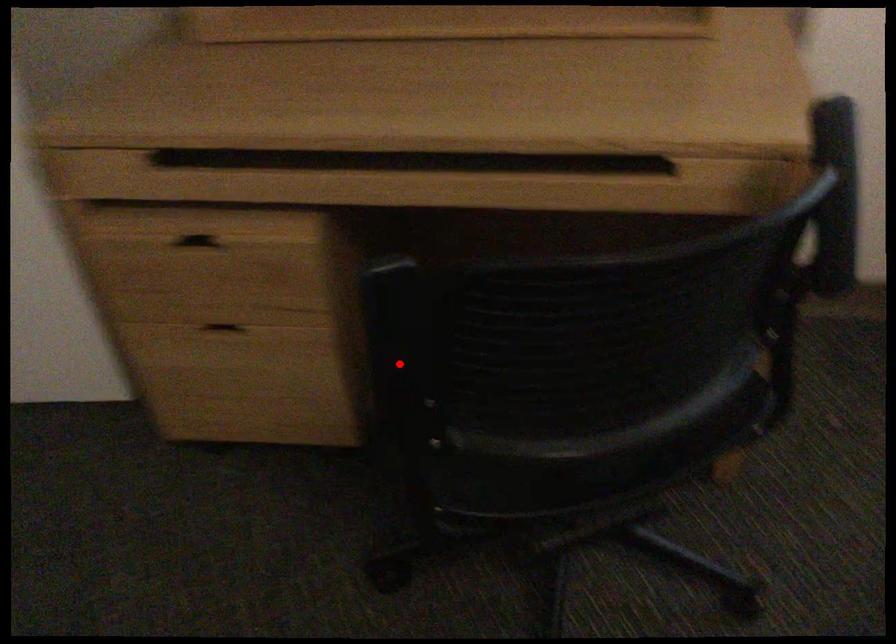
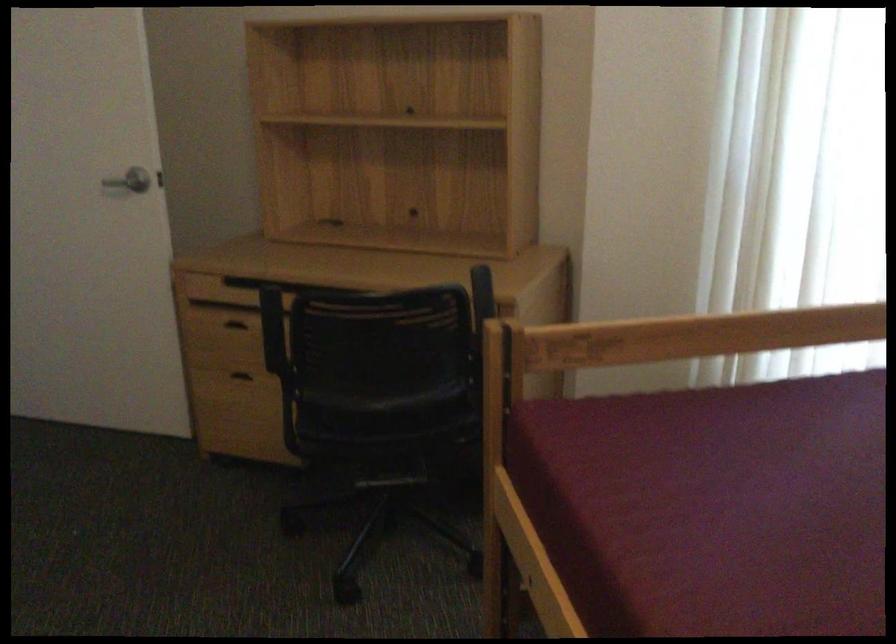
Question: I am providing you with two images of the same scene from different viewpoints. In image1, a red point is highlighted. Considering the same 3D point in image2, which of the following is correct?

Choices:
 (A) It is closer
 (B) It is farther

Answer: (B)